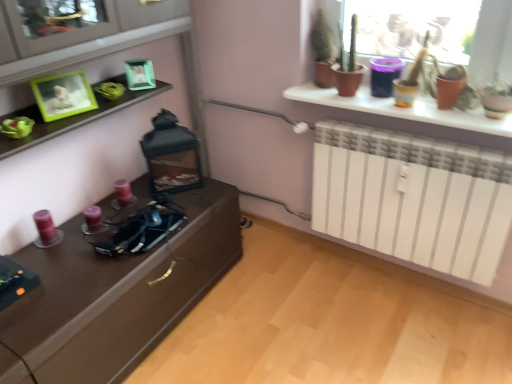
Question: From the image's perspective, is green matte picture frame at upper center, placed as the second picture frame when sorted from front to back, positioned above or below green matte picture frame at upper left, acting as the second picture frame starting from the back?

Choices:
 (A) above
 (B) below

Answer: (A)

Question: Visually, is green matte picture frame at upper center, positioned as the 2th picture frame in left-to-right order, positioned to the left or to the right of green matte picture frame at upper left, placed as the first picture frame when sorted from front to back?

Choices:
 (A) right
 (B) left

Answer: (A)

Question: Considering the positions of green matte picture frame at upper center, placed as the second picture frame when sorted from front to back, and green matte picture frame at upper left, placed as the first picture frame when sorted from front to back, in the image, is green matte picture frame at upper center, placed as the second picture frame when sorted from front to back, taller or shorter than green matte picture frame at upper left, placed as the first picture frame when sorted from front to back,?

Choices:
 (A) tall
 (B) short

Answer: (B)

Question: Considering the relative positions of green matte picture frame at upper left, placed as the first picture frame when sorted from front to back, and green matte picture frame at upper center, the 1th picture frame from the back, in the image provided, is green matte picture frame at upper left, placed as the first picture frame when sorted from front to back, to the left or to the right of green matte picture frame at upper center, the 1th picture frame from the back,?

Choices:
 (A) right
 (B) left

Answer: (B)

Question: Is green matte picture frame at upper left, the 1th picture frame viewed from the left, in front of or behind green matte picture frame at upper center, placed as the second picture frame when sorted from front to back, in the image?

Choices:
 (A) behind
 (B) front

Answer: (B)

Question: From their relative heights in the image, would you say green matte picture frame at upper left, which appears as the 2th picture frame when viewed from the right, is taller or shorter than green matte picture frame at upper center, the 1th picture frame from the back?

Choices:
 (A) tall
 (B) short

Answer: (A)

Question: From the image's perspective, is green matte picture frame at upper left, acting as the second picture frame starting from the back, located above or below green matte picture frame at upper center, placed as the second picture frame when sorted from front to back?

Choices:
 (A) below
 (B) above

Answer: (A)